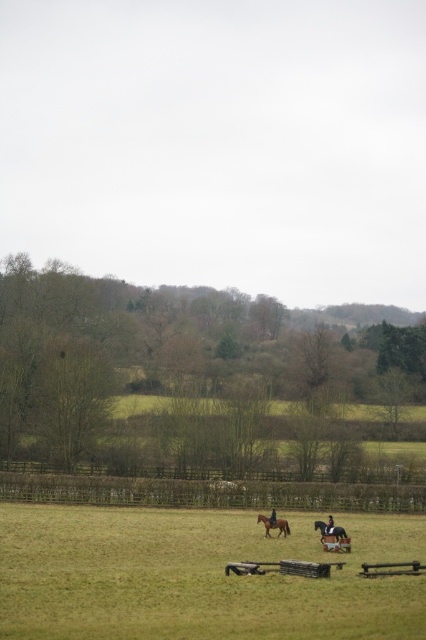
You are a photographer trying to capture a photo of the shiny black jacket at center without the brown wooden fence at lower center blocking it. Based on their heights, is this possible?

The brown wooden fence at lower center is taller than the shiny black jacket at center, so it will block the view of the shiny black jacket at center unless you adjust your angle or position to lower your viewpoint.

You are a photographer planning to capture a wide shot of the scene. The brown wooden fence at lower center and the shiny black jacket at center are both in your frame. Considering their sizes in the image, which object would appear larger in the photo?

The brown wooden fence at lower center would appear larger in the photo because its width is larger than that of the shiny black jacket at center.